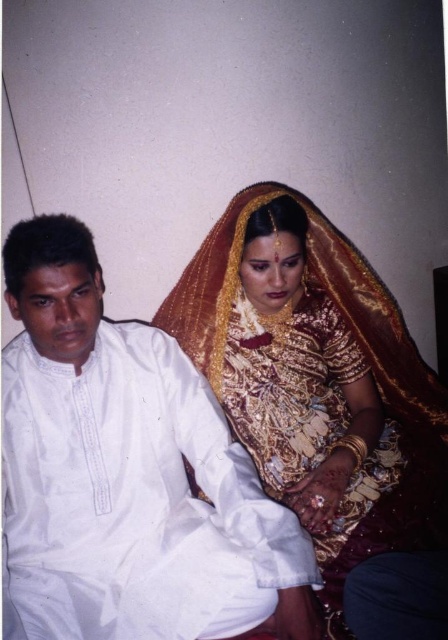
The image size is (448, 640). I want to click on white cotton kurta at left, so click(126, 472).

What do you see at coordinates (126, 472) in the screenshot? The width and height of the screenshot is (448, 640). I see `white cotton kurta at left` at bounding box center [126, 472].

Does point (126, 388) come in front of point (241, 273)?

Yes, it is in front of point (241, 273).

Identify the location of white cotton kurta at left. (126, 472).